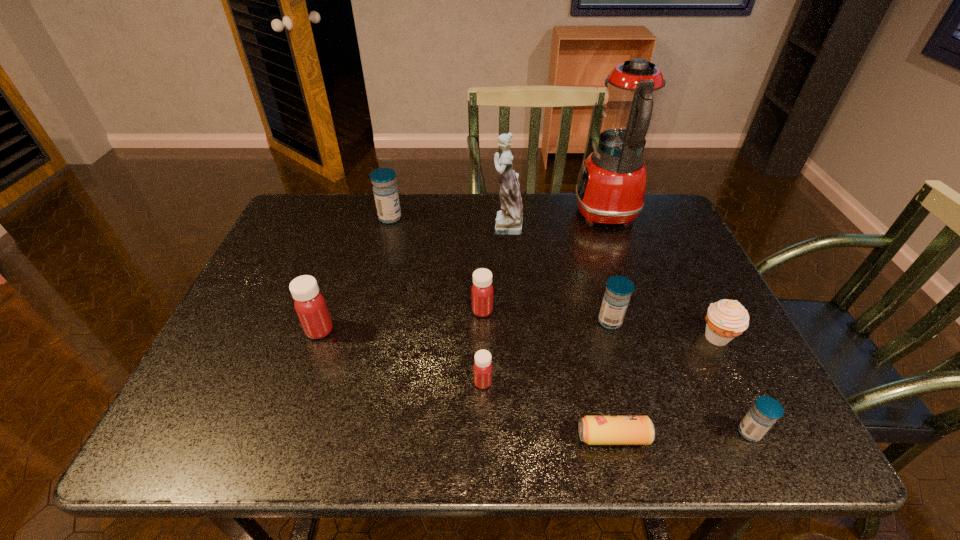
Identify the location of vacant space at the near edge of the desktop. (431, 436).

Where is `free space at the left edge of the desktop`? This screenshot has width=960, height=540. free space at the left edge of the desktop is located at coordinates (257, 272).

Locate an element on the screen. The height and width of the screenshot is (540, 960). vacant point at the right edge is located at coordinates (679, 261).

I want to click on vacant area that lies between the smallest blue medicine and the farthest red medicine, so click(616, 372).

Find the location of a particular element. The image size is (960, 540). empty location between the farthest red medicine and the tallest object is located at coordinates (544, 263).

Find the location of a particular element. This screenshot has height=540, width=960. vacant space in between the leftmost object and the beer can is located at coordinates (467, 383).

The height and width of the screenshot is (540, 960). I want to click on free space between the second smallest red medicine and the muffin, so click(600, 324).

What are the coordinates of `unoccupied area between the biggest red medicine and the ninth object from right to left` in the screenshot? It's located at (355, 274).

Locate an element on the screen. The height and width of the screenshot is (540, 960). free space that is in between the second nearest red medicine and the rightmost medicine is located at coordinates (535, 381).

Image resolution: width=960 pixels, height=540 pixels. Identify the location of free space that is in between the tallest object and the third nearest object. (544, 299).